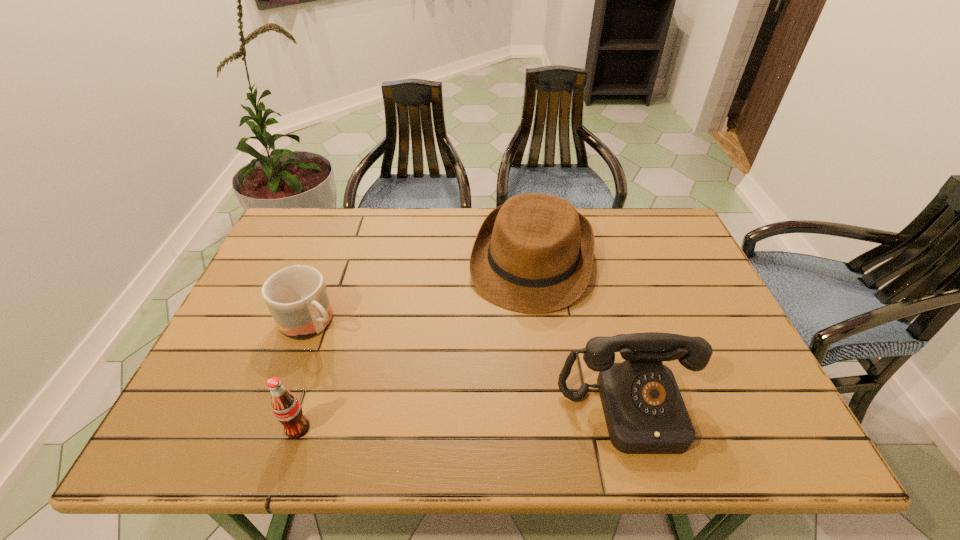
Where is `soda`? The image size is (960, 540). soda is located at coordinates (286, 407).

Where is `telephone`? The height and width of the screenshot is (540, 960). telephone is located at coordinates (644, 410).

At what (x,y) coordinates should I click in order to perform the action: click on fedora. Please return your answer as a coordinate pair (x, y). The height and width of the screenshot is (540, 960). Looking at the image, I should click on point(534,254).

Find the location of a particular element. The width and height of the screenshot is (960, 540). mug is located at coordinates (296, 296).

Find the location of a particular element. vacant space situated on the back of the soda is located at coordinates (336, 309).

The image size is (960, 540). I want to click on vacant area located 0.130m on the front-facing side of the fedora, so click(511, 351).

Where is `vacant space located on the front-facing side of the fedora`? This screenshot has height=540, width=960. vacant space located on the front-facing side of the fedora is located at coordinates (500, 393).

Locate an element on the screen. The image size is (960, 540). vacant area located on the front-facing side of the fedora is located at coordinates (513, 345).

Where is `vacant space located 0.230m on the side with the handle of the mug`? Image resolution: width=960 pixels, height=540 pixels. vacant space located 0.230m on the side with the handle of the mug is located at coordinates (396, 387).

The image size is (960, 540). I want to click on vacant space located 0.250m on the side with the handle of the mug, so (401, 392).